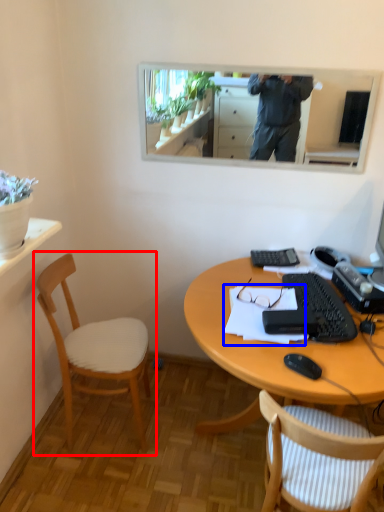
Question: Which object appears closest to the camera in this image, chair (highlighted by a red box) or notepad (highlighted by a blue box)?

Choices:
 (A) chair
 (B) notepad

Answer: (B)